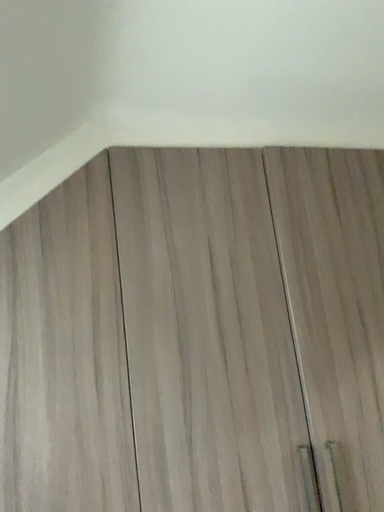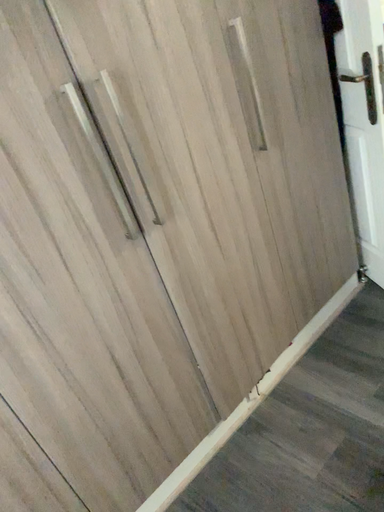
Question: How did the camera likely rotate when shooting the video?

Choices:
 (A) rotated upward
 (B) rotated downward

Answer: (B)